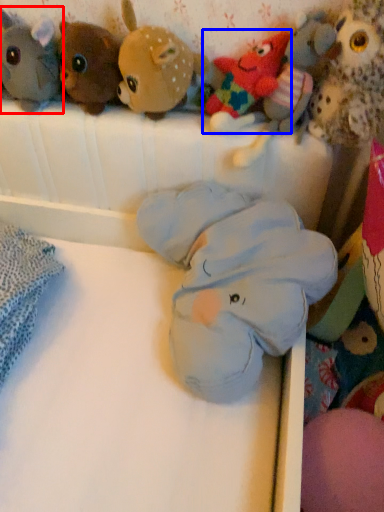
Question: Which object is closer to the camera taking this photo, toy (highlighted by a red box) or toy (highlighted by a blue box)?

Choices:
 (A) toy
 (B) toy

Answer: (B)